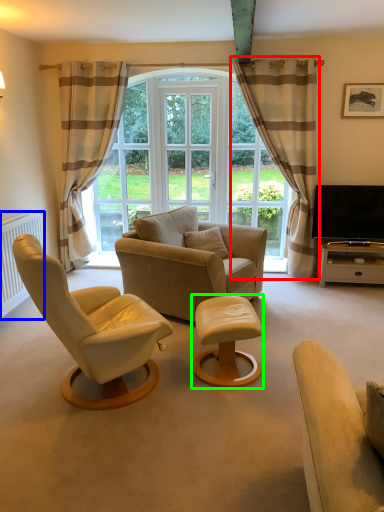
Question: Based on their relative distances, which object is farther from curtain (highlighted by a red box)? Choose from radiator (highlighted by a blue box) and table (highlighted by a green box).

Choices:
 (A) radiator
 (B) table

Answer: (A)